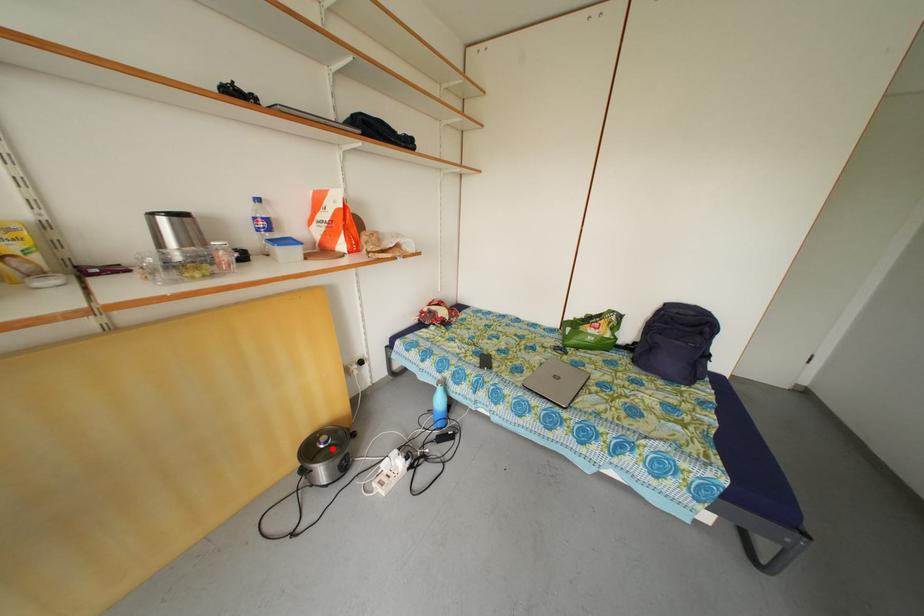
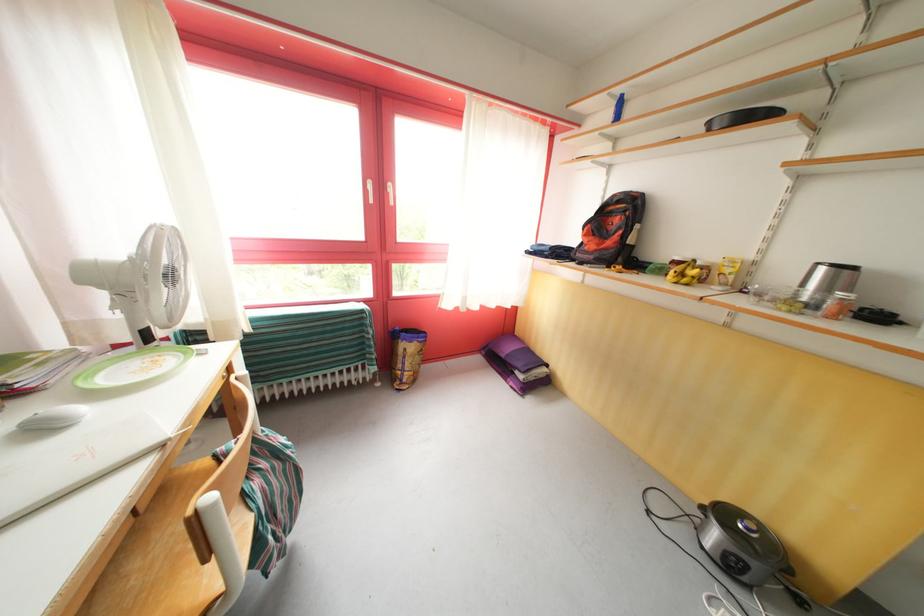
In the second image, find the point that corresponds to the highlighted location in the first image.

(755, 535)